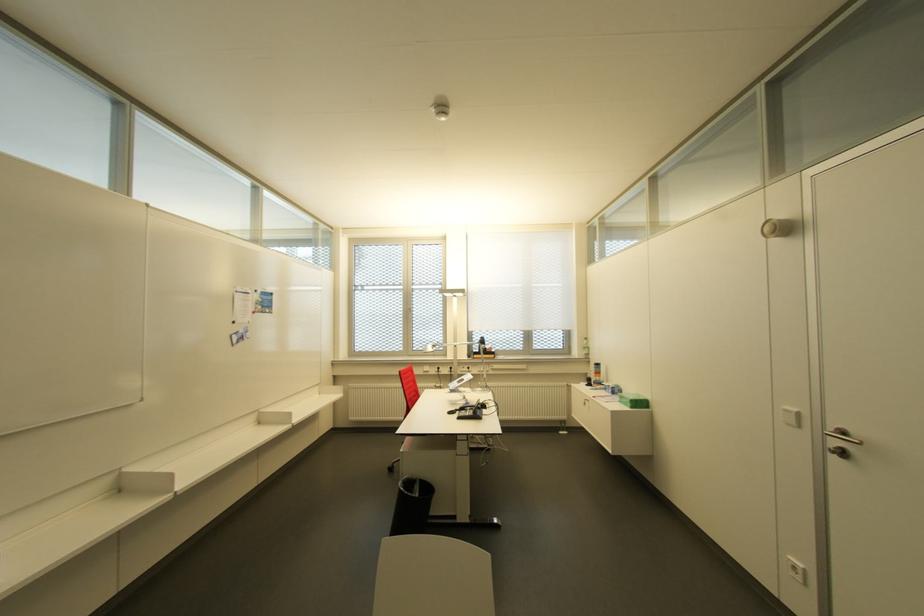
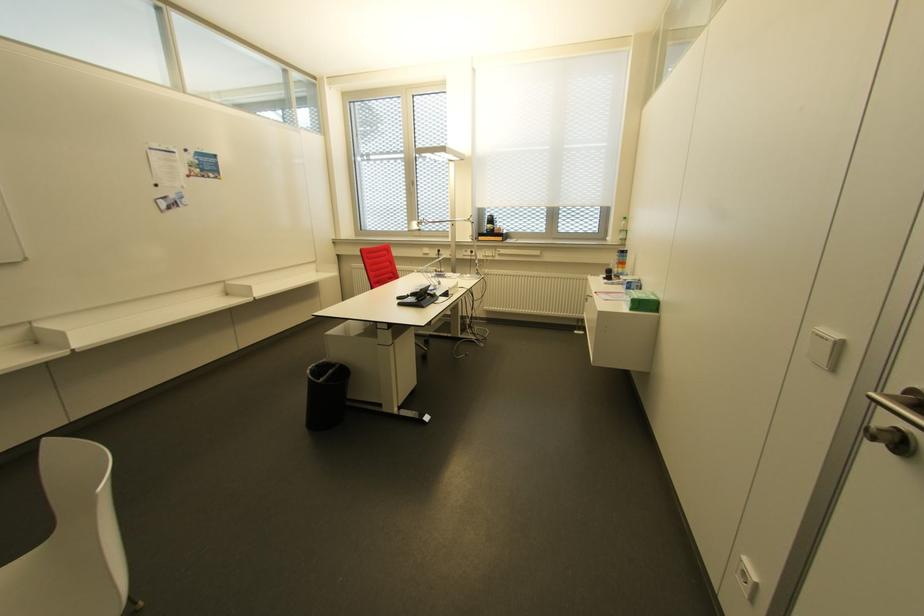
Find the pixel in the second image that matches the point at 831,434 in the first image.

(888, 397)